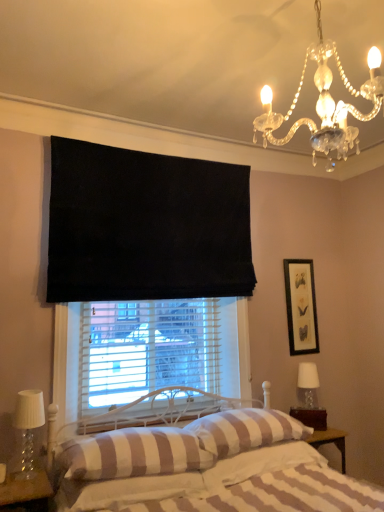
Question: From the image's perspective, is black matte picture frame at upper right under striped fabric pillow at center, which is the 3th pillow in left-to-right order?

Choices:
 (A) yes
 (B) no

Answer: (B)

Question: From the image's perspective, would you say black matte picture frame at upper right is positioned over striped fabric pillow at center, which is the 3th pillow in left-to-right order?

Choices:
 (A) yes
 (B) no

Answer: (A)

Question: Is black matte picture frame at upper right positioned behind striped fabric pillow at center, which is the 3th pillow in left-to-right order?

Choices:
 (A) no
 (B) yes

Answer: (B)

Question: Can you confirm if black matte picture frame at upper right is thinner than striped fabric pillow at center, arranged as the 1th pillow when viewed from the right?

Choices:
 (A) no
 (B) yes

Answer: (B)

Question: Could you tell me if black matte picture frame at upper right is turned towards striped fabric pillow at center, which is the 3th pillow in left-to-right order?

Choices:
 (A) no
 (B) yes

Answer: (A)

Question: Looking at the image, does clear crystal chandelier at upper right seem bigger or smaller compared to white striped fabric bed at center?

Choices:
 (A) big
 (B) small

Answer: (B)

Question: In terms of width, does clear crystal chandelier at upper right look wider or thinner when compared to white striped fabric bed at center?

Choices:
 (A) thin
 (B) wide

Answer: (A)

Question: Does point (332, 108) appear closer or farther from the camera than point (268, 468)?

Choices:
 (A) farther
 (B) closer

Answer: (B)

Question: From a real-world perspective, is clear crystal chandelier at upper right physically located above or below white striped fabric bed at center?

Choices:
 (A) above
 (B) below

Answer: (A)

Question: From a real-world perspective, is clear glass table lamp at lower left, acting as the second table lamp starting from the back, positioned above or below clear glass table lamp at right, the first table lamp from the back?

Choices:
 (A) below
 (B) above

Answer: (A)

Question: Is clear glass table lamp at lower left, the 1th table lamp when ordered from front to back, inside or outside of clear glass table lamp at right, the 1th table lamp when ordered from right to left?

Choices:
 (A) inside
 (B) outside

Answer: (B)

Question: In terms of size, does clear glass table lamp at lower left, positioned as the second table lamp in right-to-left order, appear bigger or smaller than clear glass table lamp at right, the 1th table lamp when ordered from right to left?

Choices:
 (A) small
 (B) big

Answer: (B)

Question: Considering their positions, is clear glass table lamp at lower left, acting as the second table lamp starting from the back, located in front of or behind clear glass table lamp at right, the 1th table lamp when ordered from right to left?

Choices:
 (A) behind
 (B) front

Answer: (B)

Question: Relative to striped fabric pillow at center, which appears as the 2th pillow when viewed from the left, is black matte picture frame at upper right in front or behind?

Choices:
 (A) behind
 (B) front

Answer: (A)

Question: Choose the correct answer: Is black matte picture frame at upper right inside striped fabric pillow at center, which appears as the 2th pillow when viewed from the left, or outside it?

Choices:
 (A) inside
 (B) outside

Answer: (B)